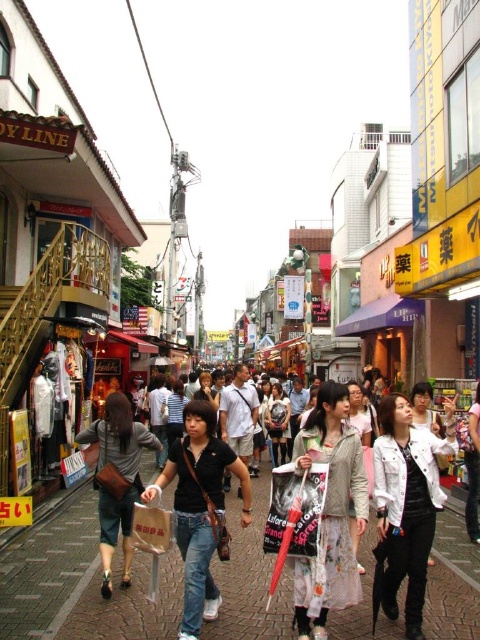
Question: Which object is the farthest from the floral fabric dress at center?

Choices:
 (A) dark gray leather bag at lower left
 (B) white matte jacket at lower right
 (C) black denim jeans at center
 (D) denim jeans at center

Answer: (A)

Question: Which point is farther to the camera?

Choices:
 (A) denim jeans at center
 (B) black denim jeans at center
 (C) floral fabric dress at center
 (D) white matte jacket at lower right

Answer: (C)

Question: Is the position of denim jeans at center more distant than that of white printed dress at center?

Choices:
 (A) no
 (B) yes

Answer: (A)

Question: Does white printed dress at center have a lesser width compared to black denim jeans at center?

Choices:
 (A) no
 (B) yes

Answer: (B)

Question: Does denim jeans at center appear on the left side of white printed dress at center?

Choices:
 (A) no
 (B) yes

Answer: (B)

Question: Among these objects, which one is farthest from the camera?

Choices:
 (A) dark gray leather bag at lower left
 (B) floral fabric dress at center
 (C) denim jeans at center
 (D) black denim jeans at center

Answer: (B)